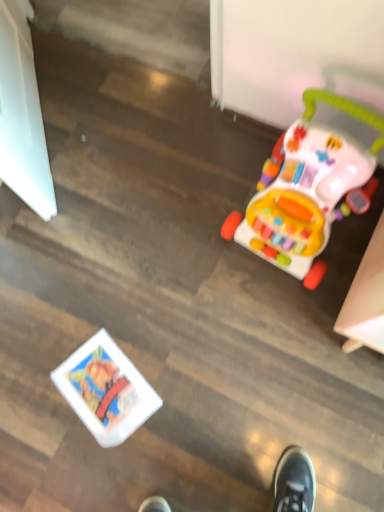
Where is `empty space that is ontop of white glossy book at lower left, the 1th toy from the bottom`? This screenshot has height=512, width=384. empty space that is ontop of white glossy book at lower left, the 1th toy from the bottom is located at coordinates (109, 387).